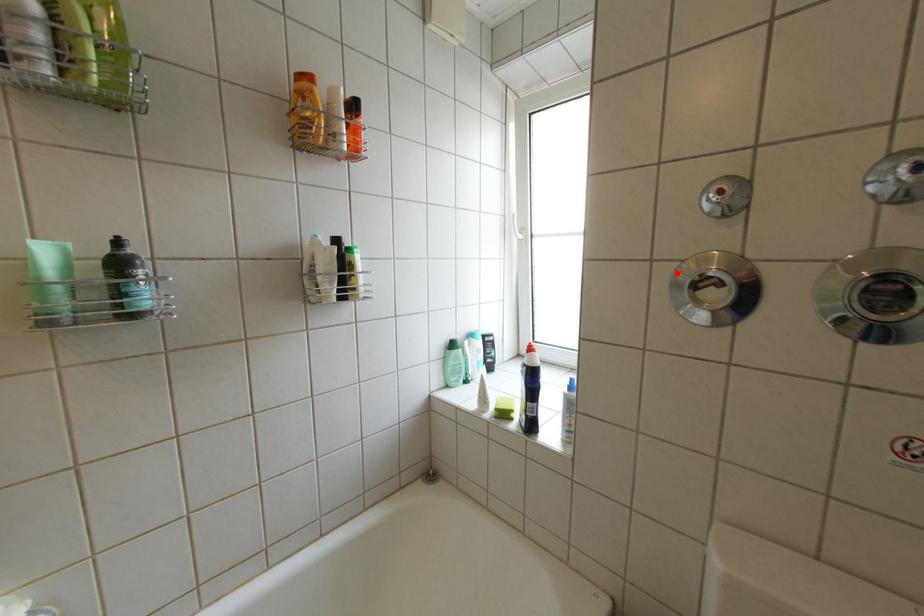
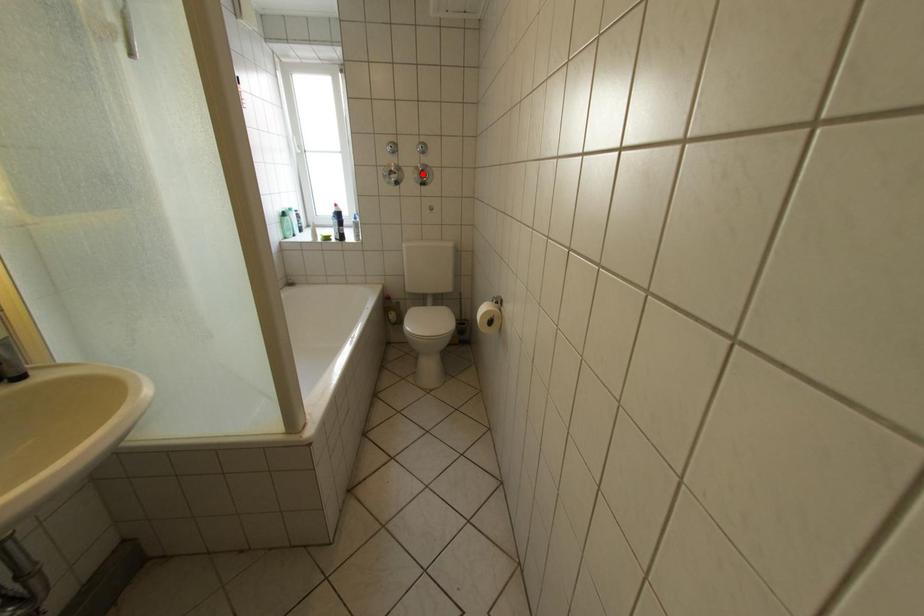
I am providing you with two images of the same scene from different viewpoints. A red point is marked on the first image and another point is marked on the second image. Do the highlighted points in image1 and image2 indicate the same real-world spot?

No